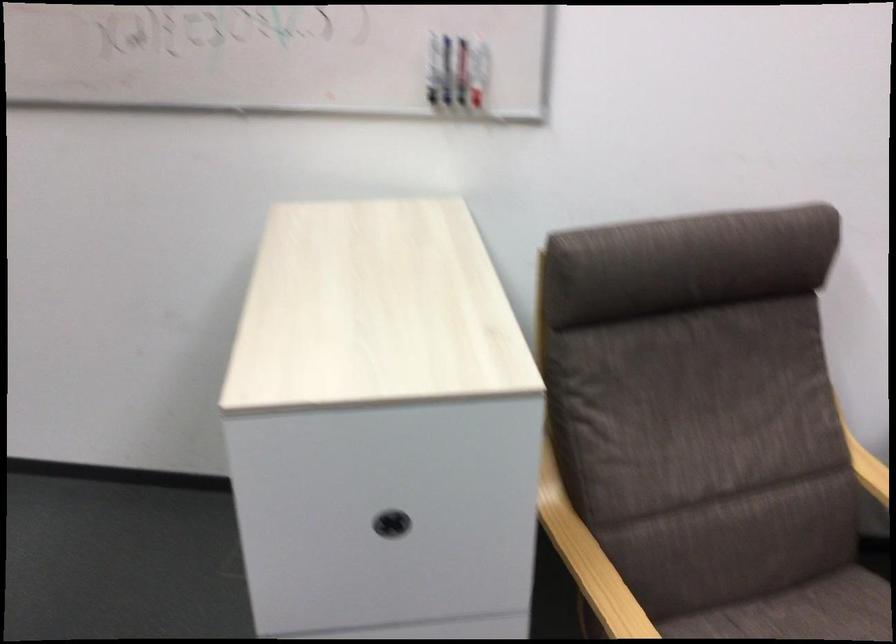
What do you see at coordinates (589, 563) in the screenshot?
I see `the chair armrest` at bounding box center [589, 563].